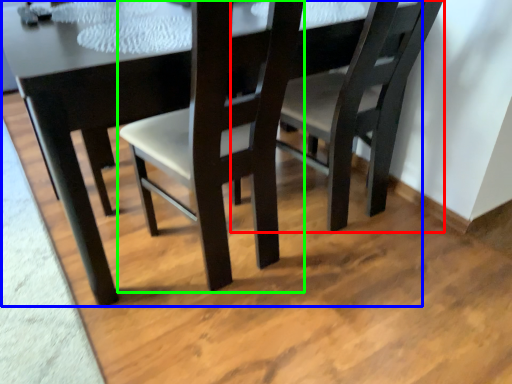
Question: Which is nearer to the chair (highlighted by a red box)? table (highlighted by a blue box) or chair (highlighted by a green box).

Choices:
 (A) table
 (B) chair

Answer: (B)